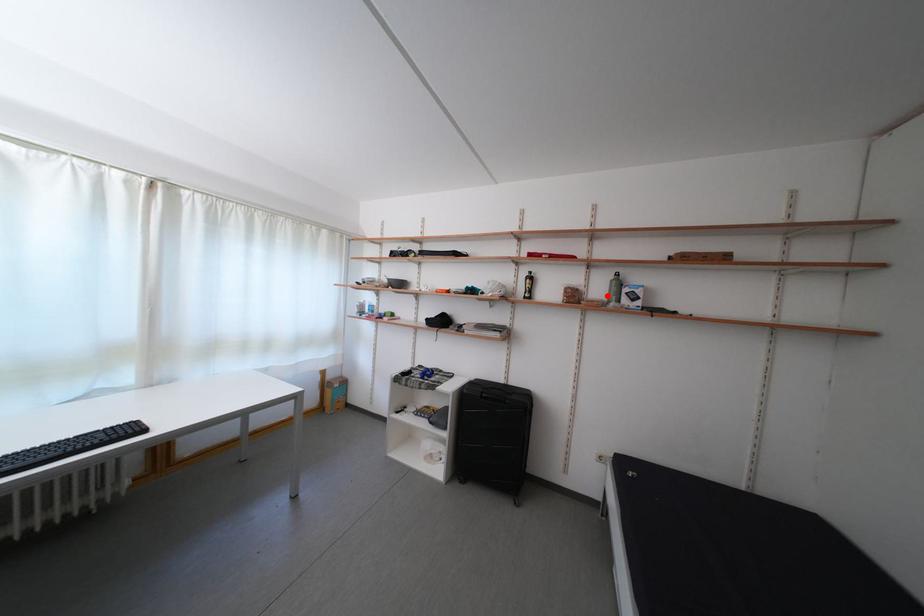
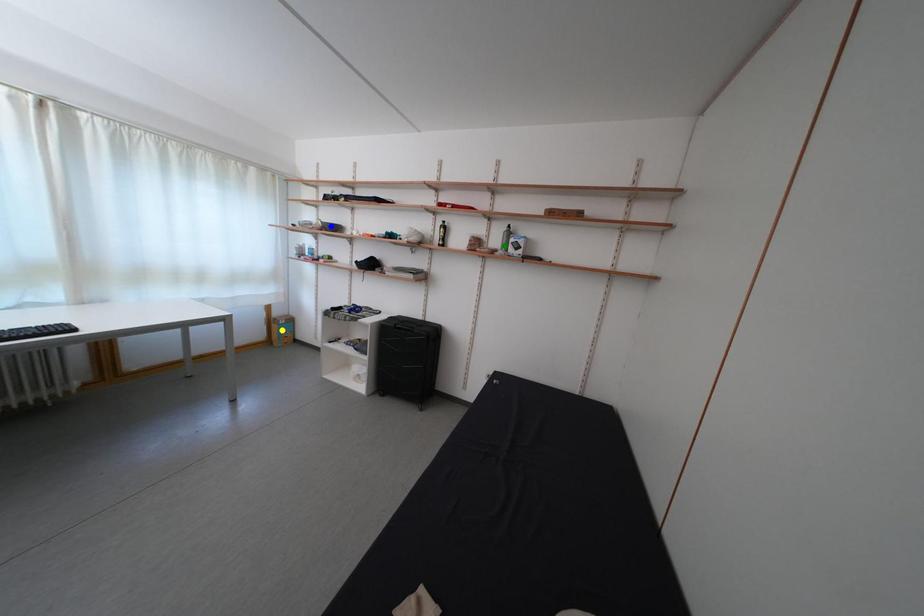
Question: I am providing you with two images of the same scene from different viewpoints. A red point is marked on the first image. You are given multiple points on the second image. Which spot in image 2 lines up with the point in image 1?

Choices:
 (A) green point
 (B) yellow point
 (C) blue point

Answer: (A)